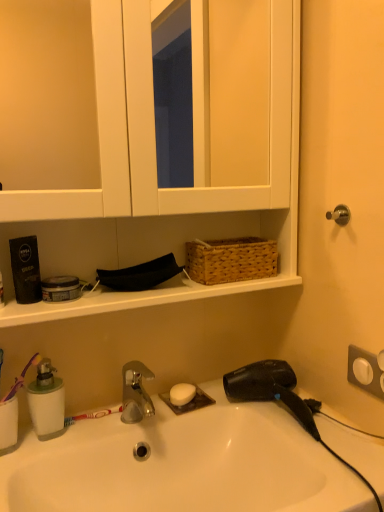
The image size is (384, 512). What are the coordinates of `free point to the left of white matte soap at center` in the screenshot? It's located at (121, 418).